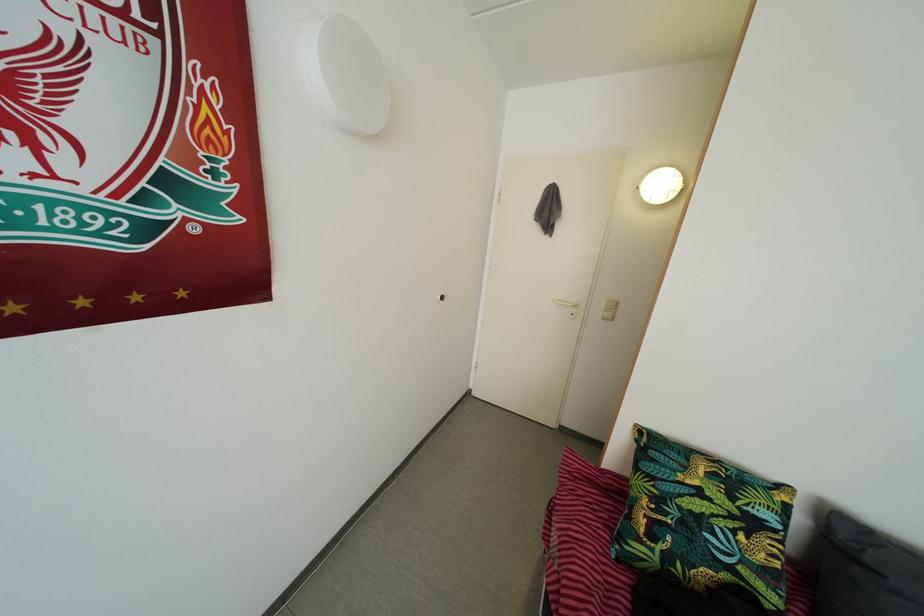
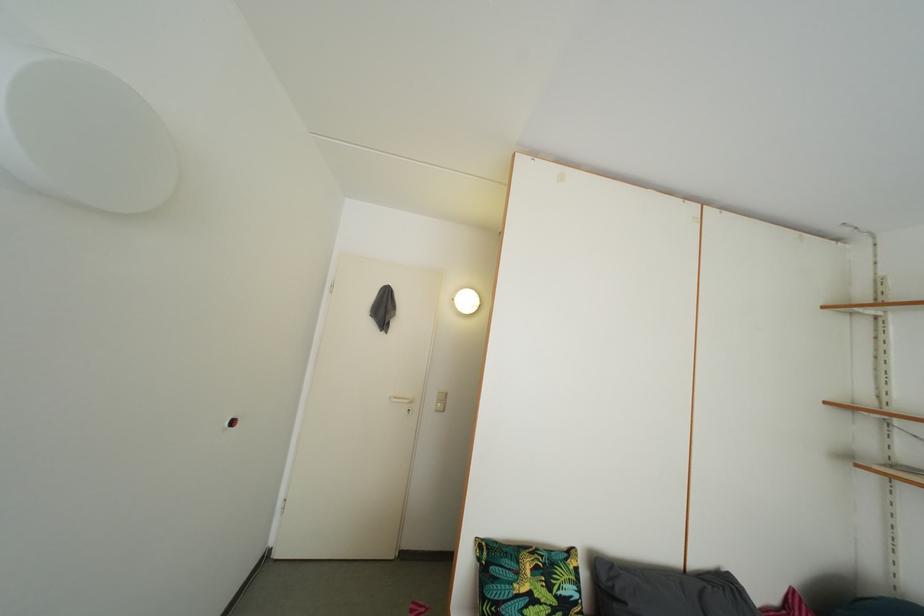
Where in the second image is the point corresponding to (x=873, y=568) from the first image?

(624, 601)